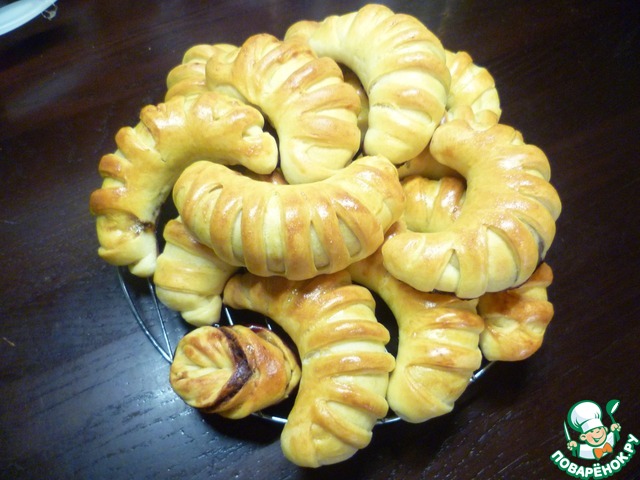
At what (x,y) coordinates should I click in order to perform the action: click on brown wooden table. Please return your answer as a coordinate pair (x, y). The width and height of the screenshot is (640, 480). Looking at the image, I should click on (48, 200).